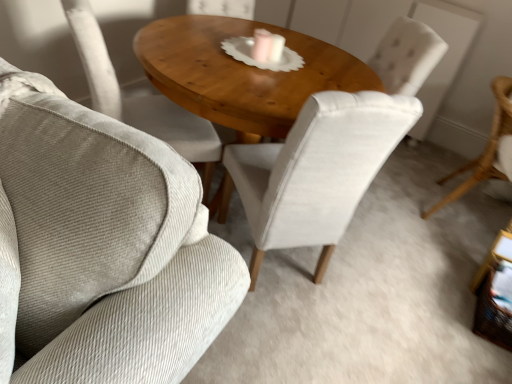
Question: In terms of height, does woven wicker side table at lower right look taller or shorter compared to light brown wicker chair at right, acting as the 1th chair starting from the right?

Choices:
 (A) short
 (B) tall

Answer: (A)

Question: In the image, is woven wicker side table at lower right on the left side or the right side of light brown wicker chair at right, acting as the 1th chair starting from the right?

Choices:
 (A) right
 (B) left

Answer: (B)

Question: Considering the real-world distances, which object is farthest from the light beige fabric chair at center, which is counted as the first chair, starting from the left?

Choices:
 (A) velvet white chair at center, which ranks as the 2th chair in right-to-left order
 (B) wooden polished table at center
 (C) light brown wicker chair at right, positioned as the 3th chair in left-to-right order
 (D) woven wicker side table at lower right

Answer: (C)

Question: Which object is the farthest from the light brown wicker chair at right, acting as the 1th chair starting from the right?

Choices:
 (A) woven wicker side table at lower right
 (B) velvet white chair at center, placed as the 2th chair when sorted from left to right
 (C) wooden polished table at center
 (D) light beige fabric chair at center, which ranks as the third chair in right-to-left order

Answer: (D)